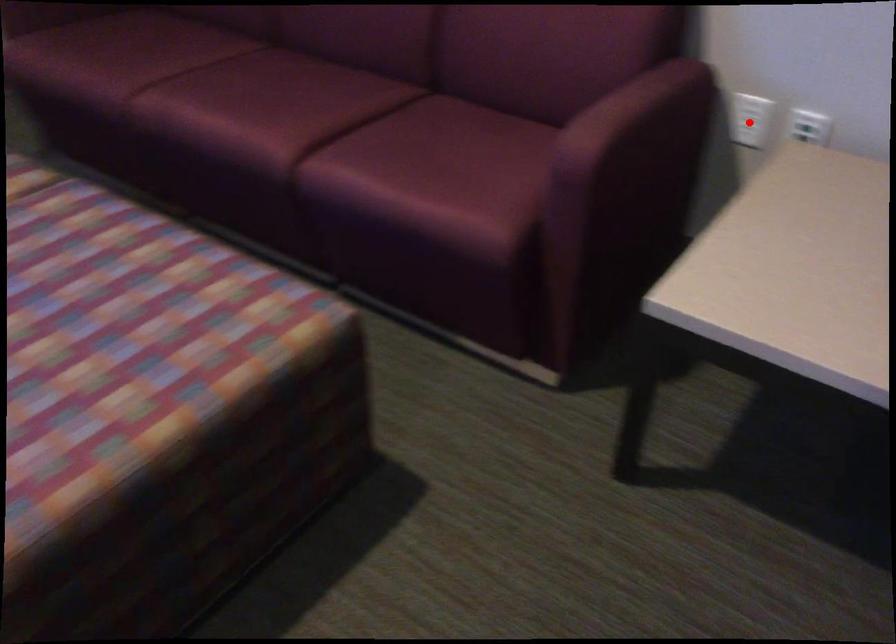
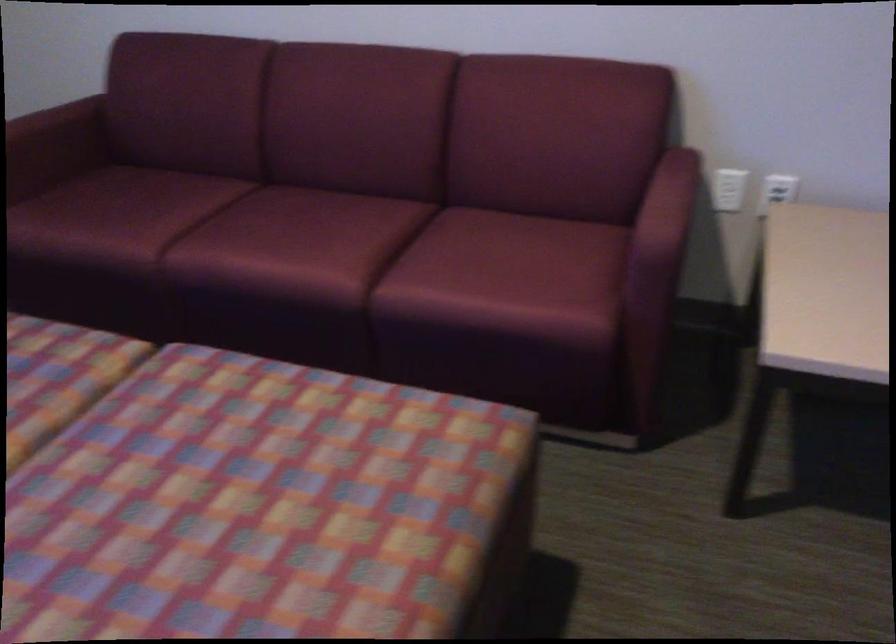
Find the pixel in the second image that matches the highlighted location in the first image.

(728, 189)